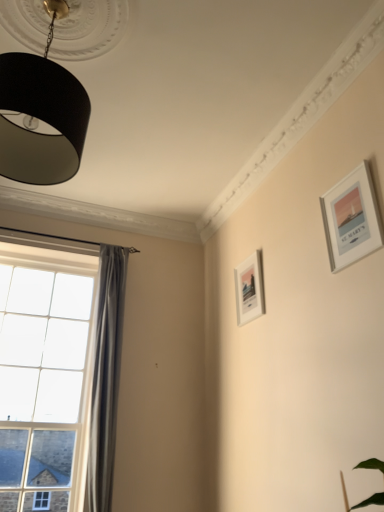
What do you see at coordinates (249, 289) in the screenshot?
I see `white matte picture frame at center-right, which ranks as the first picture frame in bottom-to-top order` at bounding box center [249, 289].

This screenshot has width=384, height=512. What do you see at coordinates (42, 114) in the screenshot?
I see `black matte lampshade at upper left` at bounding box center [42, 114].

The width and height of the screenshot is (384, 512). What are the coordinates of `satin grey curtain at left` in the screenshot? It's located at [x=106, y=377].

Find the location of `white matte picture frame at center-right, which ranks as the first picture frame in bottom-to-top order`. white matte picture frame at center-right, which ranks as the first picture frame in bottom-to-top order is located at coordinates (249, 289).

Is satin grey curtain at left looking in the opposite direction of black matte lampshade at upper left?

No, satin grey curtain at left is not facing the opposite direction of black matte lampshade at upper left.

From the image's perspective, is satin grey curtain at left beneath black matte lampshade at upper left?

Yes, from the image's perspective, satin grey curtain at left is below black matte lampshade at upper left.

Is satin grey curtain at left in front of black matte lampshade at upper left?

No, it is behind black matte lampshade at upper left.

Considering the sizes of objects satin grey curtain at left and black matte lampshade at upper left in the image provided, who is wider, satin grey curtain at left or black matte lampshade at upper left?

With larger width is black matte lampshade at upper left.

Relative to silver metallic picture frame at upper right, the 1th picture frame from the top, is black matte lampshade at upper left in front or behind?

Clearly, black matte lampshade at upper left is in front of silver metallic picture frame at upper right, the 1th picture frame from the top.

In the scene shown: From the image's perspective, between black matte lampshade at upper left and silver metallic picture frame at upper right, the 1th picture frame from the top, which one is located above?

From the image's view, black matte lampshade at upper left is above.

From a real-world perspective, between black matte lampshade at upper left and silver metallic picture frame at upper right, the second picture frame in the back-to-front sequence, who is vertically higher?

black matte lampshade at upper left is physically above.

Considering the sizes of black matte lampshade at upper left and silver metallic picture frame at upper right, which is counted as the 1th picture frame, starting from the front, in the image, is black matte lampshade at upper left wider or thinner than silver metallic picture frame at upper right, which is counted as the 1th picture frame, starting from the front,?

Considering their sizes, black matte lampshade at upper left looks broader than silver metallic picture frame at upper right, which is counted as the 1th picture frame, starting from the front.

Consider the image. In the image, is silver metallic picture frame at upper right, placed as the 2th picture frame when sorted from left to right, on the left side or the right side of white matte picture frame at center-right, which is the 2th picture frame from front to back?

Clearly, silver metallic picture frame at upper right, placed as the 2th picture frame when sorted from left to right, is on the right of white matte picture frame at center-right, which is the 2th picture frame from front to back, in the image.

Does silver metallic picture frame at upper right, which ranks as the 2th picture frame in bottom-to-top order, have a greater width compared to white matte picture frame at center-right, marked as the 2th picture frame in a right-to-left arrangement?

Indeed, silver metallic picture frame at upper right, which ranks as the 2th picture frame in bottom-to-top order, has a greater width compared to white matte picture frame at center-right, marked as the 2th picture frame in a right-to-left arrangement.

Based on the photo, is silver metallic picture frame at upper right, placed as the 2th picture frame when sorted from left to right, positioned far away from white matte picture frame at center-right, which is the 2th picture frame from front to back?

No, silver metallic picture frame at upper right, placed as the 2th picture frame when sorted from left to right, is in close proximity to white matte picture frame at center-right, which is the 2th picture frame from front to back.

Does silver metallic picture frame at upper right, which is counted as the 1th picture frame, starting from the front, contain clear glass window at left?

No, clear glass window at left is not a part of silver metallic picture frame at upper right, which is counted as the 1th picture frame, starting from the front.

Is the position of silver metallic picture frame at upper right, which is counted as the 1th picture frame, starting from the front, more distant than that of clear glass window at left?

No, it is in front of clear glass window at left.

From a real-world perspective, between silver metallic picture frame at upper right, the first picture frame in the right-to-left sequence, and clear glass window at left, who is vertically lower?

clear glass window at left is physically lower.

In the scene shown: From the image's perspective, is silver metallic picture frame at upper right, the 1th picture frame from the top, located above clear glass window at left?

Indeed, from the image's perspective, silver metallic picture frame at upper right, the 1th picture frame from the top, is shown above clear glass window at left.

Based on the photo, how far apart are clear glass window at left and silver metallic picture frame at upper right, placed as the 2th picture frame when sorted from left to right?

The distance of clear glass window at left from silver metallic picture frame at upper right, placed as the 2th picture frame when sorted from left to right, is 1.79 meters.

Would you say clear glass window at left is a long distance from silver metallic picture frame at upper right, the second picture frame in the back-to-front sequence?

clear glass window at left is far away from silver metallic picture frame at upper right, the second picture frame in the back-to-front sequence.

Is point (104, 372) farther from viewer compared to point (330, 196)?

Yes, it is behind point (330, 196).

Which is behind, clear glass window at left or silver metallic picture frame at upper right, which is counted as the 1th picture frame, starting from the front?

clear glass window at left is more distant.

Considering the sizes of objects black matte lampshade at upper left and clear glass window at left in the image provided, who is thinner, black matte lampshade at upper left or clear glass window at left?

clear glass window at left is thinner.

Is black matte lampshade at upper left in front of or behind clear glass window at left in the image?

black matte lampshade at upper left is positioned closer to the viewer than clear glass window at left.

Between black matte lampshade at upper left and clear glass window at left, which one has less height?

With less height is black matte lampshade at upper left.

Looking at this image, considering the relative sizes of clear glass window at left and black matte lampshade at upper left in the image provided, is clear glass window at left bigger than black matte lampshade at upper left?

Yes.

Is clear glass window at left with black matte lampshade at upper left?

No.

Which of these two, clear glass window at left or black matte lampshade at upper left, stands shorter?

black matte lampshade at upper left.

From a real-world perspective, which is physically above, clear glass window at left or black matte lampshade at upper left?

black matte lampshade at upper left is physically above.

The width and height of the screenshot is (384, 512). What are the coordinates of `curtain that appears behind the black matte lampshade at upper left` in the screenshot? It's located at (106, 377).

At what (x,y) coordinates should I click in order to perform the action: click on lamp above the silver metallic picture frame at upper right, the first picture frame in the right-to-left sequence (from a real-world perspective). Please return your answer as a coordinate pair (x, y). Looking at the image, I should click on (42, 114).

Considering their positions, is white matte picture frame at center-right, which is counted as the 1th picture frame, starting from the back, positioned closer to satin grey curtain at left than clear glass window at left?

clear glass window at left is closer to satin grey curtain at left.

Which object lies further to the anchor point clear glass window at left, satin grey curtain at left or black matte lampshade at upper left?

black matte lampshade at upper left is further to clear glass window at left.

When comparing their distances from clear glass window at left, does white matte picture frame at center-right, which is counted as the second picture frame, starting from the top, or black matte lampshade at upper left seem further?

Among the two, black matte lampshade at upper left is located further to clear glass window at left.

When comparing their distances from clear glass window at left, does black matte lampshade at upper left or white matte picture frame at center-right, which is counted as the 1th picture frame, starting from the back, seem closer?

white matte picture frame at center-right, which is counted as the 1th picture frame, starting from the back, is closer to clear glass window at left.

From the image, which object appears to be farther from black matte lampshade at upper left, white matte picture frame at center-right, which is counted as the second picture frame, starting from the top, or clear glass window at left?

clear glass window at left.

Looking at the image, which one is located further to clear glass window at left, silver metallic picture frame at upper right, placed as the 2th picture frame when sorted from left to right, or black matte lampshade at upper left?

silver metallic picture frame at upper right, placed as the 2th picture frame when sorted from left to right, lies further to clear glass window at left than the other object.

Considering their positions, is white matte picture frame at center-right, marked as the 2th picture frame in a right-to-left arrangement, positioned further to clear glass window at left than silver metallic picture frame at upper right, the 1th picture frame from the top?

Based on the image, silver metallic picture frame at upper right, the 1th picture frame from the top, appears to be further to clear glass window at left.

Based on their spatial positions, is clear glass window at left or silver metallic picture frame at upper right, the 1th picture frame from the top, further from white matte picture frame at center-right, marked as the 2th picture frame in a right-to-left arrangement?

The object further to white matte picture frame at center-right, marked as the 2th picture frame in a right-to-left arrangement, is clear glass window at left.

The height and width of the screenshot is (512, 384). I want to click on curtain between clear glass window at left and white matte picture frame at center-right, positioned as the first picture frame in left-to-right order, from left to right, so click(x=106, y=377).

Where is `lamp between clear glass window at left and silver metallic picture frame at upper right, the second picture frame in the back-to-front sequence, from left to right`? lamp between clear glass window at left and silver metallic picture frame at upper right, the second picture frame in the back-to-front sequence, from left to right is located at coordinates (42, 114).

The width and height of the screenshot is (384, 512). I want to click on curtain between clear glass window at left and silver metallic picture frame at upper right, the 1th picture frame from the top, so click(106, 377).

Image resolution: width=384 pixels, height=512 pixels. I want to click on picture frame between black matte lampshade at upper left and silver metallic picture frame at upper right, placed as the 2th picture frame when sorted from left to right, in the horizontal direction, so click(x=249, y=289).